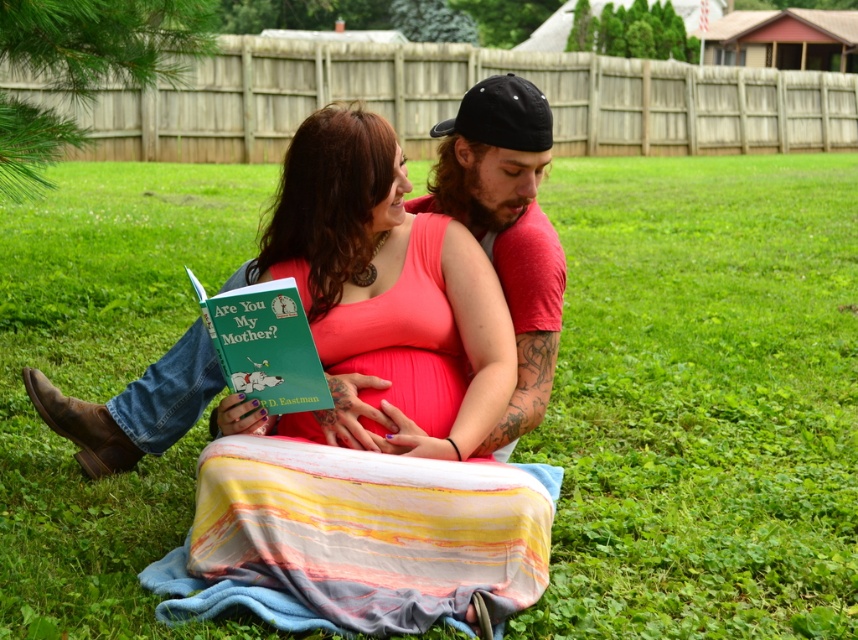
Between green matte book at center and smooth pink skin at center, which one appears on the right side from the viewer's perspective?

smooth pink skin at center

Where is `green matte book at center`? The image size is (858, 640). green matte book at center is located at coordinates (264, 344).

Which is below, pink fabric at center or matte black cap at upper center?

Positioned lower is pink fabric at center.

Measure the distance between pink fabric at center and matte black cap at upper center.

The distance of pink fabric at center from matte black cap at upper center is 44.78 centimeters.

Find the location of a particular element. pink fabric at center is located at coordinates [x=382, y=300].

Can you confirm if pink fabric at center is bigger than green matte book at center?

Yes.

Which is more to the right, pink fabric at center or green matte book at center?

pink fabric at center

Is point (433, 228) farther from camera compared to point (303, 352)?

Yes, it is.

I want to click on pink fabric at center, so click(x=382, y=300).